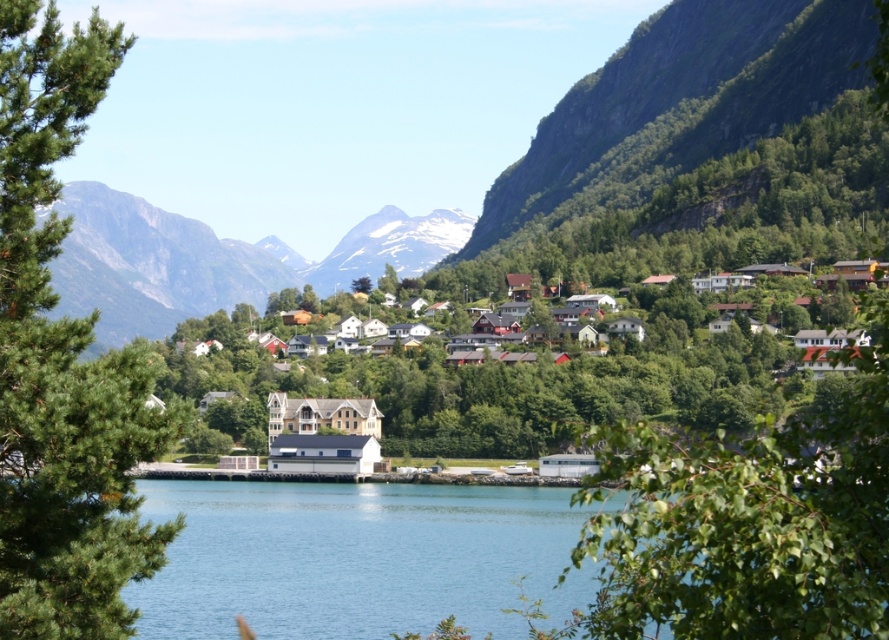
You are a hiker standing at the base of the green rocky mountain at upper right. You want to reach the summit. If your average hiking speed is 3 km per hour, how long will it take you to reach the summit?

The distance between the green rocky mountain at upper right and the viewer is 318.87 meters. Converting meters to kilometers, that is 0.31887 km. At an average hiking speed of 3 km per hour, the time required would be approximately 0.31887 km divided by 3 km per hour, which equals about 0.106 hours. Converting this to minutes by multiplying by 60, you get roughly 6.36 minutes. Therefore, it would take approximately 6 minutes to reach the summit.

You are a tourist standing at the edge of the fjord, admiring the view of the green leafy tree at left and the white wooden houses at center. Which object appears closer to you in the scene?

The green leafy tree at left appears closer to you than the white wooden houses at center because it is smaller in the scene.

You are standing on a cliff overlooking the coastal village. You see the green leafy tree at left and the white wooden houses at center. Which object is closer to you?

The green leafy tree at left is closer to you because the white wooden houses at center is behind it.